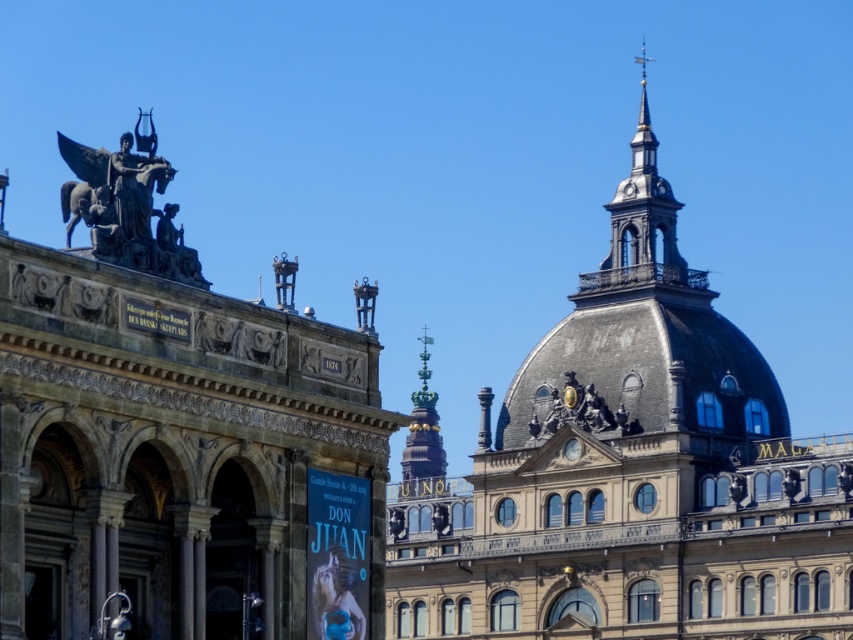
You are an architect analyzing the two structures in the image. The smooth gray dome at upper center and the bronze statue at upper center are both at the top of their respective buildings. Which structure has a wider feature at its top?

The smooth gray dome at upper center has a wider feature at its top compared to the bronze statue at upper center, as the dome surpasses the statue in width.

You are standing at the point with coordinates point [173,256] and want to walk towards the point [671,593]. Which direction should you move in relation to the two buildings shown in the scene?

You should move towards the classical European architecture building on the left side because point [671,593] is behind point [173,256], meaning it is located further back in the scene. Since the classical European building is on the left, moving towards it would align with the direction of the points.